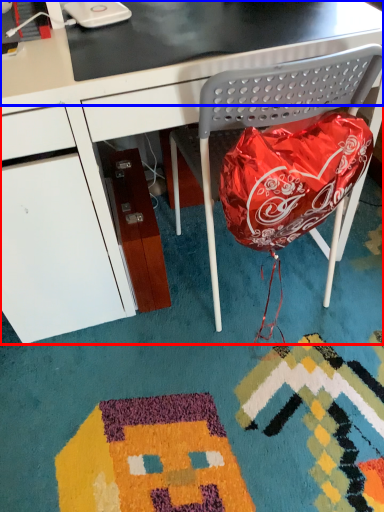
Question: Which point is closer to the camera, desk (highlighted by a red box) or table top (highlighted by a blue box)?

Choices:
 (A) desk
 (B) table top

Answer: (A)